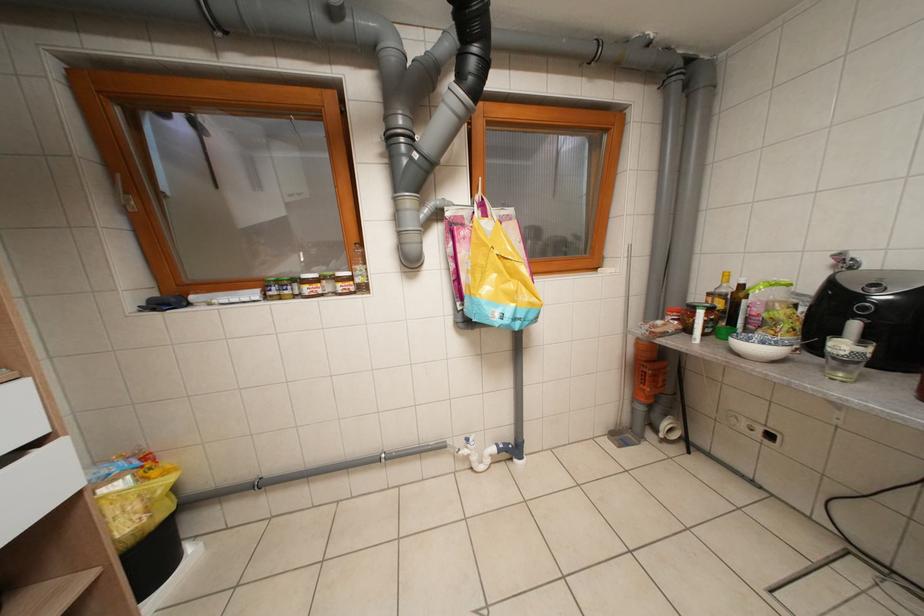
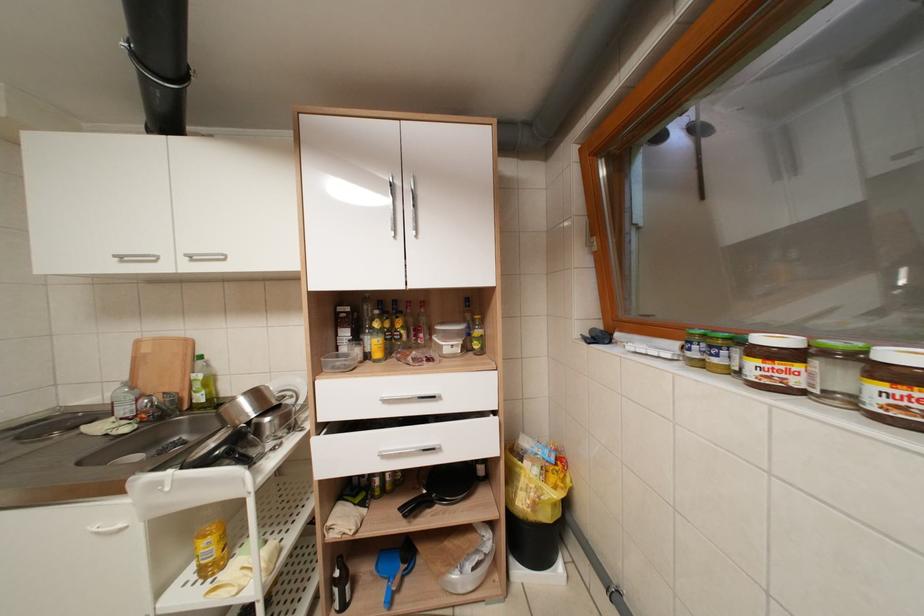
Question: The camera is either moving clockwise (left) or counter-clockwise (right) around the object. The first image is from the beginning of the video and the second image is from the end. Is the camera moving left or right when shooting the video?

Choices:
 (A) Left
 (B) Right

Answer: (B)